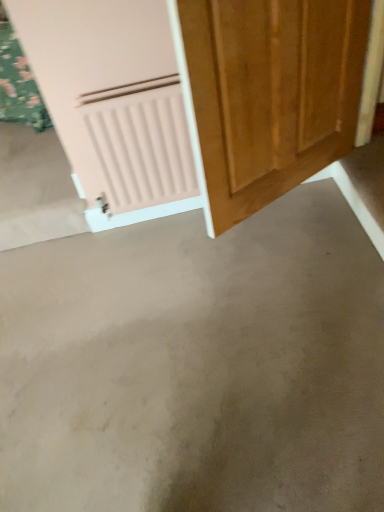
Question: Does gray concrete at center lie behind wooden door at center?

Choices:
 (A) yes
 (B) no

Answer: (A)

Question: Considering the relative positions of gray concrete at center and wooden door at center in the image provided, is gray concrete at center to the right of wooden door at center from the viewer's perspective?

Choices:
 (A) no
 (B) yes

Answer: (A)

Question: Does gray concrete at center have a larger size compared to wooden door at center?

Choices:
 (A) yes
 (B) no

Answer: (A)

Question: From a real-world perspective, is gray concrete at center positioned under wooden door at center based on gravity?

Choices:
 (A) no
 (B) yes

Answer: (B)

Question: Is gray concrete at center oriented towards wooden door at center?

Choices:
 (A) yes
 (B) no

Answer: (B)

Question: Could wooden door at center be considered to be inside gray concrete at center?

Choices:
 (A) yes
 (B) no

Answer: (B)

Question: Considering the relative sizes of wooden door at center and gray concrete at center in the image provided, is wooden door at center thinner than gray concrete at center?

Choices:
 (A) yes
 (B) no

Answer: (A)

Question: Is wooden door at center looking in the opposite direction of gray concrete at center?

Choices:
 (A) yes
 (B) no

Answer: (B)

Question: From the image's perspective, does wooden door at center appear lower than gray concrete at center?

Choices:
 (A) no
 (B) yes

Answer: (A)

Question: Would you say wooden door at center is outside gray concrete at center?

Choices:
 (A) no
 (B) yes

Answer: (B)

Question: From the image's perspective, is wooden door at center over gray concrete at center?

Choices:
 (A) yes
 (B) no

Answer: (A)

Question: From a real-world perspective, is wooden door at center on gray concrete at center?

Choices:
 (A) yes
 (B) no

Answer: (A)

Question: From a real-world perspective, is wooden door at center positioned above or below gray concrete at center?

Choices:
 (A) below
 (B) above

Answer: (B)